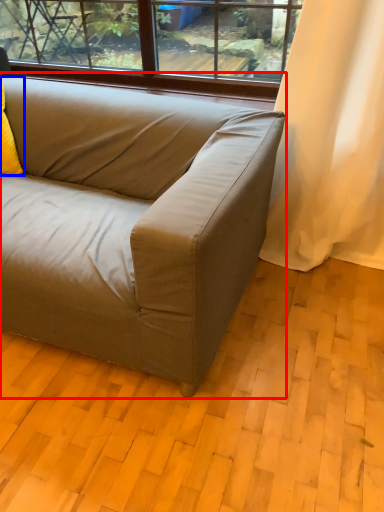
Question: Which point is further to the camera, studio couch (highlighted by a red box) or pillow (highlighted by a blue box)?

Choices:
 (A) studio couch
 (B) pillow

Answer: (B)